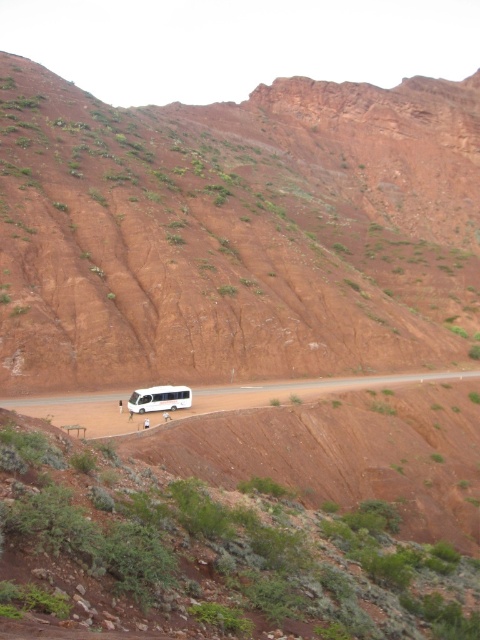
Question: Which object appears farthest from the camera in this image?

Choices:
 (A) dull reddish-brown rock at center
 (B) white matte tour bus at center
 (C) white matte dirt track at center

Answer: (A)

Question: Which point is closer to the camera?

Choices:
 (A) (135, 400)
 (B) (364, 280)
 (C) (96, 419)

Answer: (C)

Question: From the image, what is the correct spatial relationship of dull reddish-brown rock at center in relation to white matte dirt track at center?

Choices:
 (A) below
 (B) above

Answer: (B)

Question: Can you confirm if white matte dirt track at center is thinner than white matte tour bus at center?

Choices:
 (A) no
 (B) yes

Answer: (A)

Question: Which point is closer to the camera?

Choices:
 (A) (300, 134)
 (B) (324, 381)

Answer: (B)

Question: Can you confirm if dull reddish-brown rock at center is bigger than white matte dirt track at center?

Choices:
 (A) yes
 (B) no

Answer: (A)